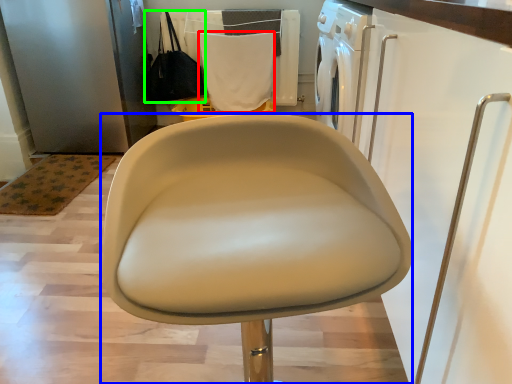
Question: Considering the real-world distances, which object is closest to cloth (highlighted by a red box)? chair (highlighted by a blue box) or handbag (highlighted by a green box).

Choices:
 (A) chair
 (B) handbag

Answer: (B)